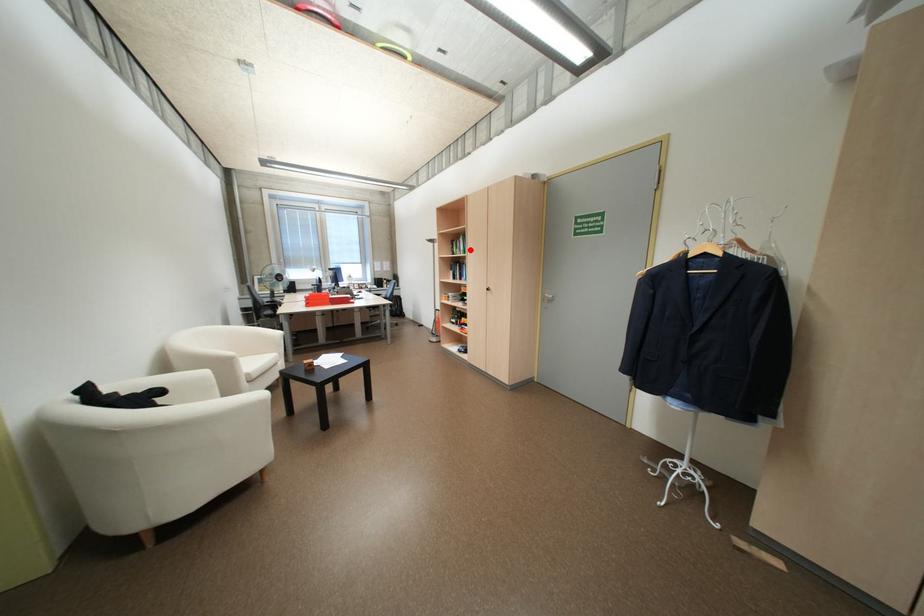
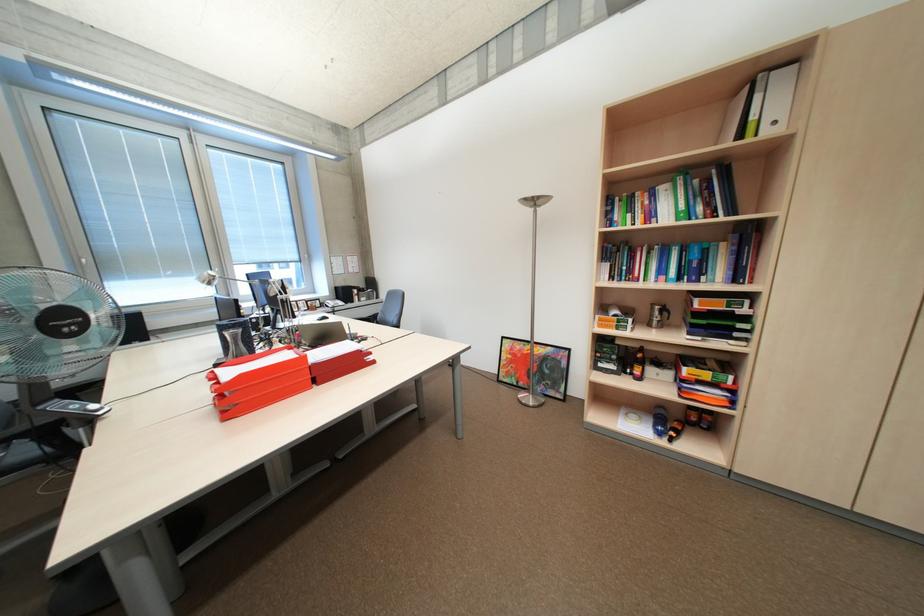
Locate, in the second image, the point that corresponds to the highlighted location in the first image.

(661, 215)